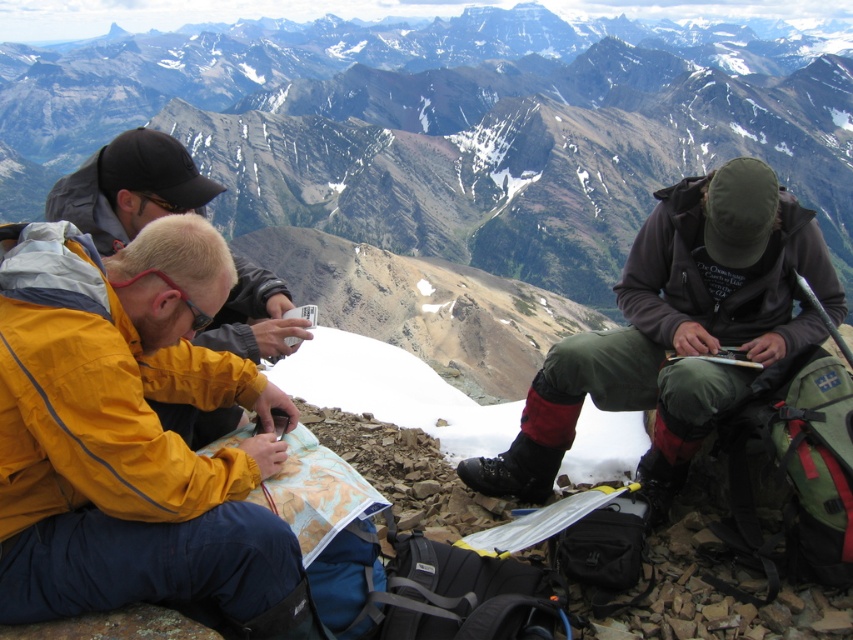
Can you confirm if yellow waterproof jacket at lower left is thinner than dark brown jacket at right?

Yes, yellow waterproof jacket at lower left is thinner than dark brown jacket at right.

From the picture: Between yellow waterproof jacket at lower left and dark brown jacket at right, which one is positioned lower?

yellow waterproof jacket at lower left is lower down.

What do you see at coordinates (128, 432) in the screenshot? I see `yellow waterproof jacket at lower left` at bounding box center [128, 432].

You are a GUI agent. You are given a task and a screenshot of the screen. Output one action in this format:
    pyautogui.click(x=<x>, y=<y>)
    Task: Click on the yellow waterproof jacket at lower left
    
    Given the screenshot: What is the action you would take?
    pyautogui.click(x=128, y=432)

Based on the photo, is rocky mountain range at center to the right of dark brown jacket at right from the viewer's perspective?

Indeed, rocky mountain range at center is positioned on the right side of dark brown jacket at right.

Is rocky mountain range at center bigger than dark brown jacket at right?

Yes.

Measure the distance between rocky mountain range at center and camera.

rocky mountain range at center and camera are 573.25 feet apart from each other.

I want to click on rocky mountain range at center, so [x=457, y=128].

Who is positioned more to the left, rocky mountain range at center or yellow waterproof jacket at lower left?

From the viewer's perspective, yellow waterproof jacket at lower left appears more on the left side.

From the picture: Does rocky mountain range at center appear on the left side of yellow waterproof jacket at lower left?

No, rocky mountain range at center is not to the left of yellow waterproof jacket at lower left.

Which is in front, point (585, 96) or point (33, 294)?

Point (33, 294) is more forward.

The width and height of the screenshot is (853, 640). Find the location of `rocky mountain range at center`. rocky mountain range at center is located at coordinates (457, 128).